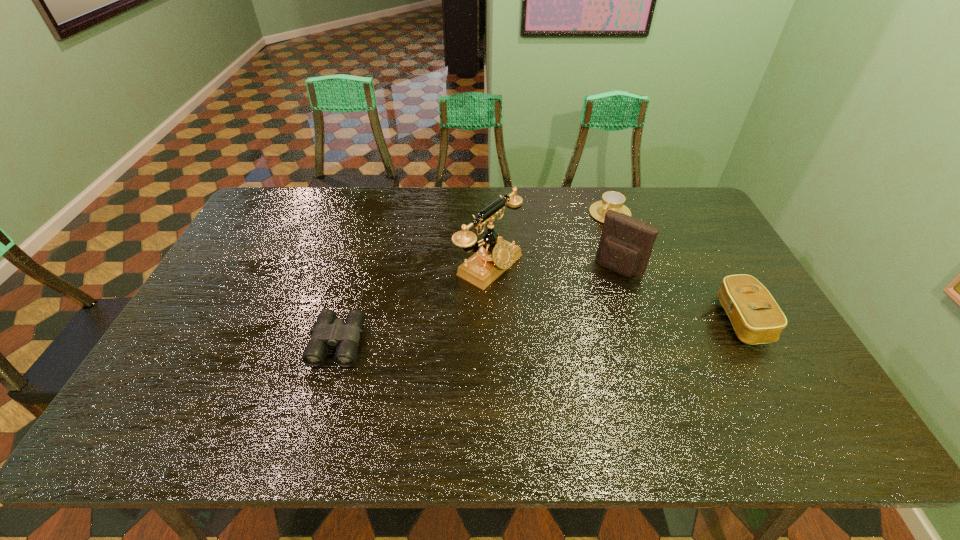
The width and height of the screenshot is (960, 540). In order to click on vacant region between the third tallest object and the tallest object in this screenshot , I will do `click(615, 293)`.

Where is `free space between the telephone and the rightmost object`? free space between the telephone and the rightmost object is located at coordinates (615, 293).

Identify which object is the nearest to the leftmost object. Please provide its 2D coordinates. Your answer should be formatted as a tuple, i.e. [(x, y)], where the tuple contains the x and y coordinates of a point satisfying the conditions above.

[(496, 255)]

Identify which object is the fourth nearest to the rightmost object. Please provide its 2D coordinates. Your answer should be formatted as a tuple, i.e. [(x, y)], where the tuple contains the x and y coordinates of a point satisfying the conditions above.

[(328, 331)]

I want to click on vacant region that satisfies the following two spatial constraints: 1. on the front side of the pouch; 2. on the right side of the tallest object, so click(490, 268).

This screenshot has height=540, width=960. I want to click on blank area in the image that satisfies the following two spatial constraints: 1. on the front side of the clutch bag; 2. on the zipper side of the tallest object, so click(x=491, y=320).

At what (x,y) coordinates should I click in order to perform the action: click on vacant space that satisfies the following two spatial constraints: 1. on the front side of the third shortest object; 2. on the zipper side of the cup. Please return your answer as a coordinate pair (x, y). This screenshot has height=540, width=960. Looking at the image, I should click on (648, 320).

Where is `vacant area in the image that satisfies the following two spatial constraints: 1. on the front side of the fourth object from right to left; 2. on the zipper side of the clutch bag`? vacant area in the image that satisfies the following two spatial constraints: 1. on the front side of the fourth object from right to left; 2. on the zipper side of the clutch bag is located at coordinates (491, 320).

Where is `free location that satisfies the following two spatial constraints: 1. on the front side of the pouch; 2. on the zipper side of the third shortest object`? This screenshot has width=960, height=540. free location that satisfies the following two spatial constraints: 1. on the front side of the pouch; 2. on the zipper side of the third shortest object is located at coordinates (636, 320).